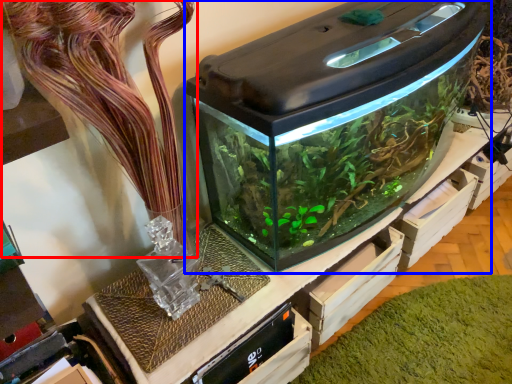
Question: Which object appears farthest to the camera in this image, plant (highlighted by a red box) or home appliance (highlighted by a blue box)?

Choices:
 (A) plant
 (B) home appliance

Answer: (B)